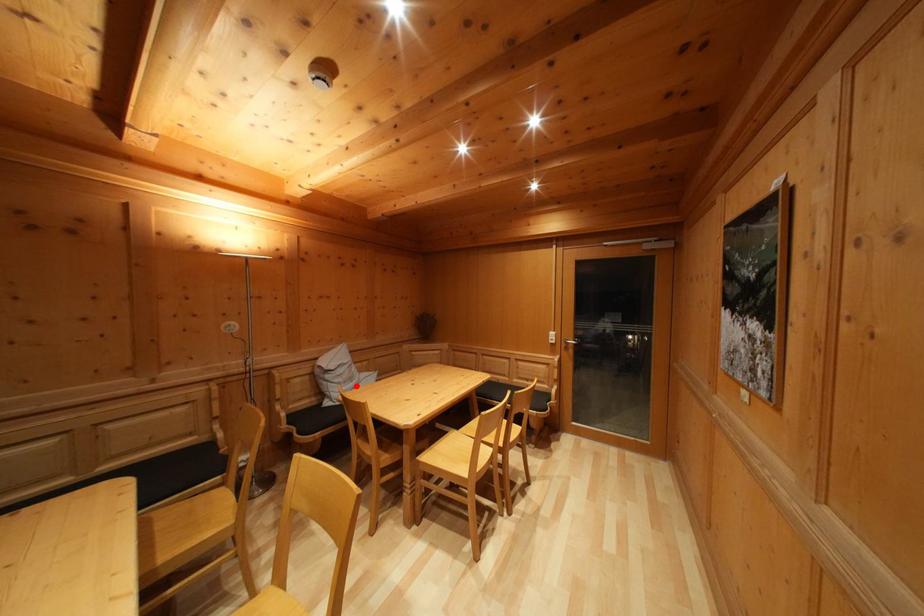
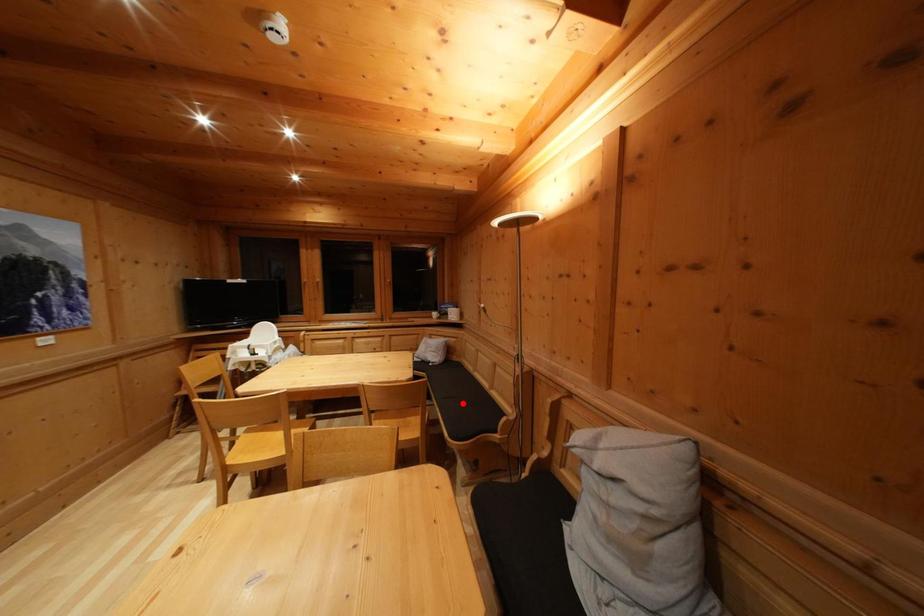
I am providing you with two images of the same scene from different viewpoints. A red point is marked on the first image and another point is marked on the second image. Is the red point in image1 aligned with the point shown in image2?

No